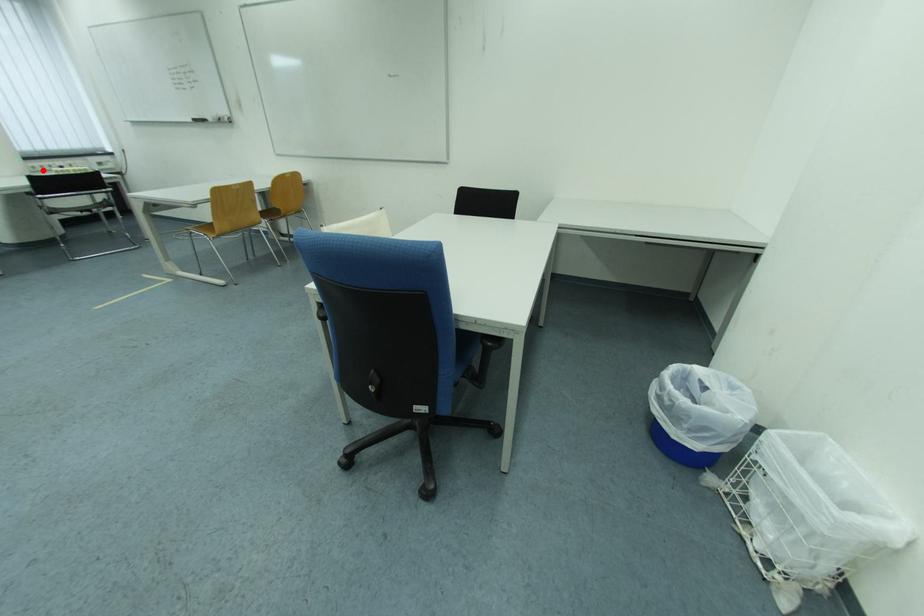
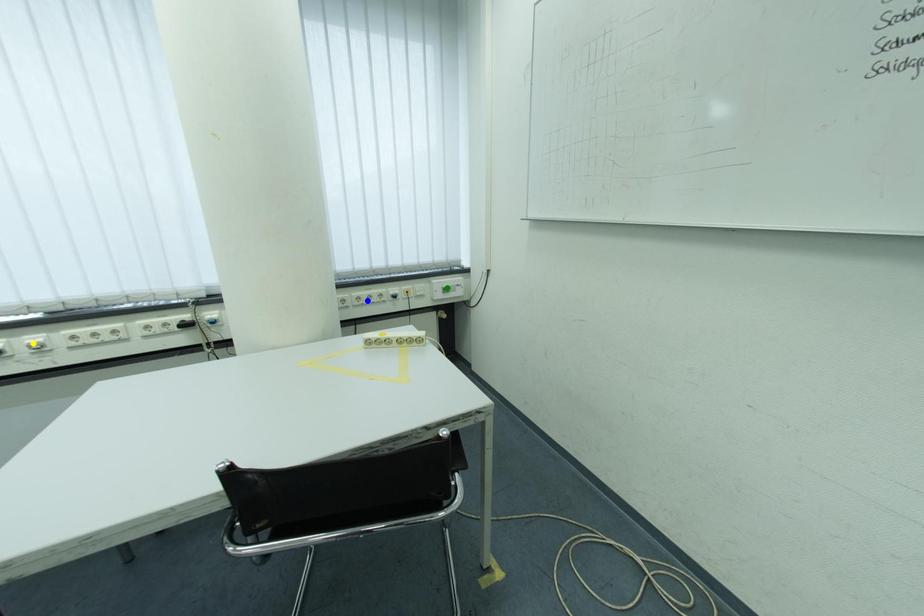
Question: I am providing you with two images of the same scene from different viewpoints. A red point is marked on the first image. You are given multiple points on the second image. Which point in image 2 is actually the same real-world point as the red point in image 1?

Choices:
 (A) yellow point
 (B) blue point
 (C) green point

Answer: (B)